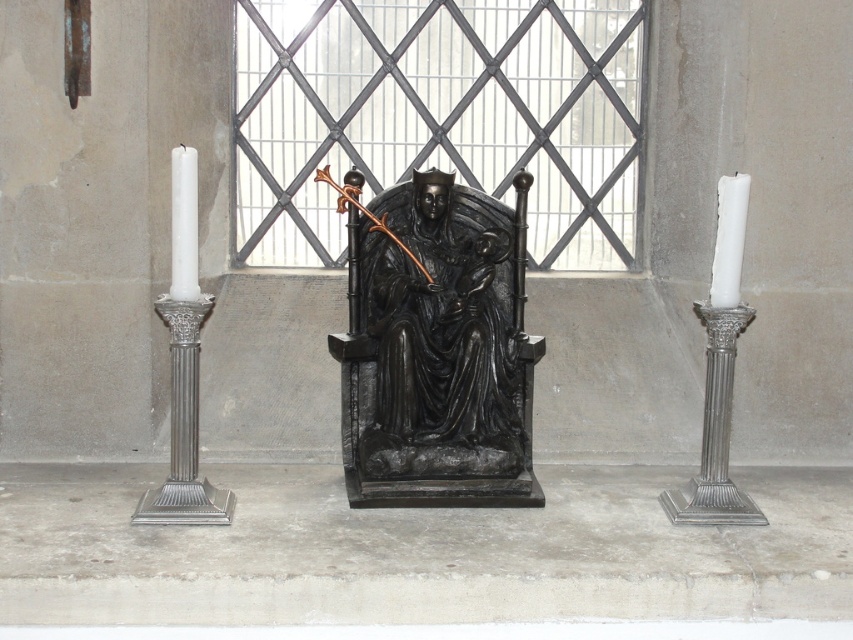
You are standing in the cathedral looking at the statue and the two candlesticks. There are two points marked on the image. One is at coordinate point [619,140] and the other at point [712,497]. Which point is closer to you?

Point [619,140] is further to the camera than point [712,497], so the point closer to you is point [712,497].

You are a maintenance worker in the cathedral. You need to place a new 3.5 feet long ladder between the metallic grid window at center and the white matte candle at left. Can you fit the ladder horizontally between them?

The distance between the metallic grid window at center and the white matte candle at left is 4.33 feet. Since the ladder is 3.5 feet long, it can fit horizontally between them as the available space is larger than the ladder length.

You are an interior designer planning to install a new light fixture above the black polished wood throne at center. Considering the current placement of the white matte candle at right, where should you position the new light fixture to avoid blocking the candle?

The black polished wood throne at center is located below the white matte candle at right, so positioning the new light fixture above the throne would place it directly beneath the existing candle. To avoid blocking the candle, the light fixture should be placed to the side or behind the throne, ensuring it does not interfere with the candlestick.